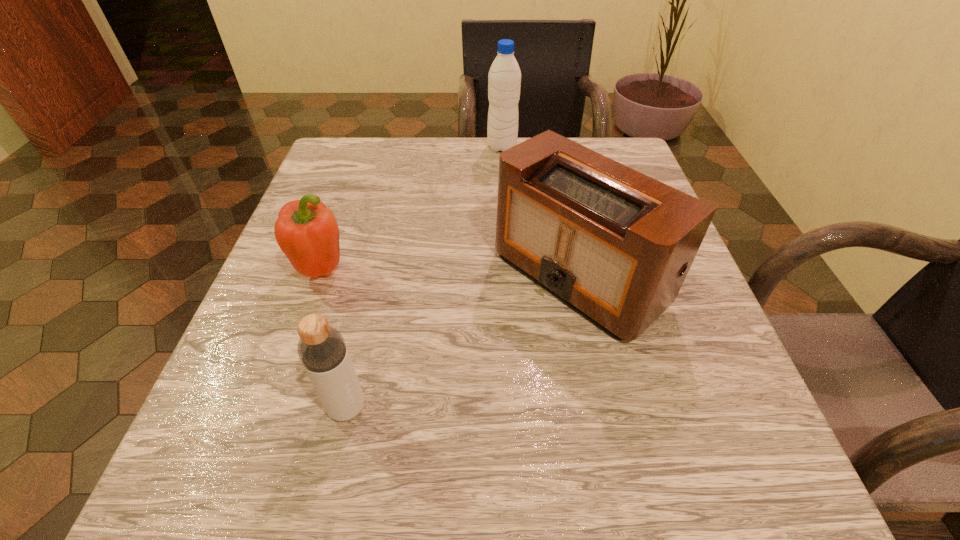
Locate an element on the screen. The height and width of the screenshot is (540, 960). the farthest object is located at coordinates (504, 79).

The width and height of the screenshot is (960, 540). Identify the location of water bottle. (504, 79).

Identify the location of radio receiver. The image size is (960, 540). (615, 245).

The image size is (960, 540). I want to click on bottle, so click(x=321, y=348).

Find the location of a particular element. The width and height of the screenshot is (960, 540). the second object from left to right is located at coordinates (321, 348).

Identify the location of the leftmost object. The width and height of the screenshot is (960, 540). (307, 232).

Where is `free point located on the left of the tallest object`? The image size is (960, 540). free point located on the left of the tallest object is located at coordinates (347, 147).

The image size is (960, 540). I want to click on blank area located 0.150m on the front of the radio receiver, so click(x=614, y=444).

Where is `vacant space located 0.180m on the back of the bottle`? The image size is (960, 540). vacant space located 0.180m on the back of the bottle is located at coordinates (372, 294).

Find the location of `vacant area situated on the right of the pepper`. vacant area situated on the right of the pepper is located at coordinates (425, 270).